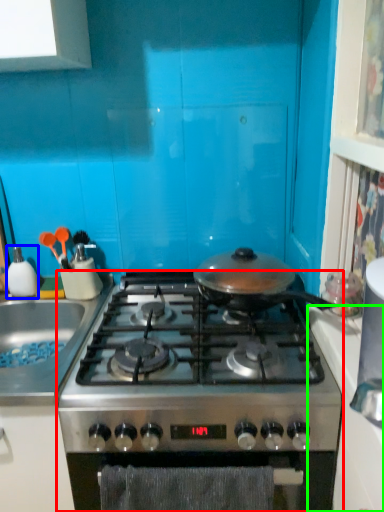
Question: Based on their relative distances, which object is farther from gas stove (highlighted by a red box)? Choose from kitchen appliance (highlighted by a blue box) and counter top (highlighted by a green box).

Choices:
 (A) kitchen appliance
 (B) counter top

Answer: (A)